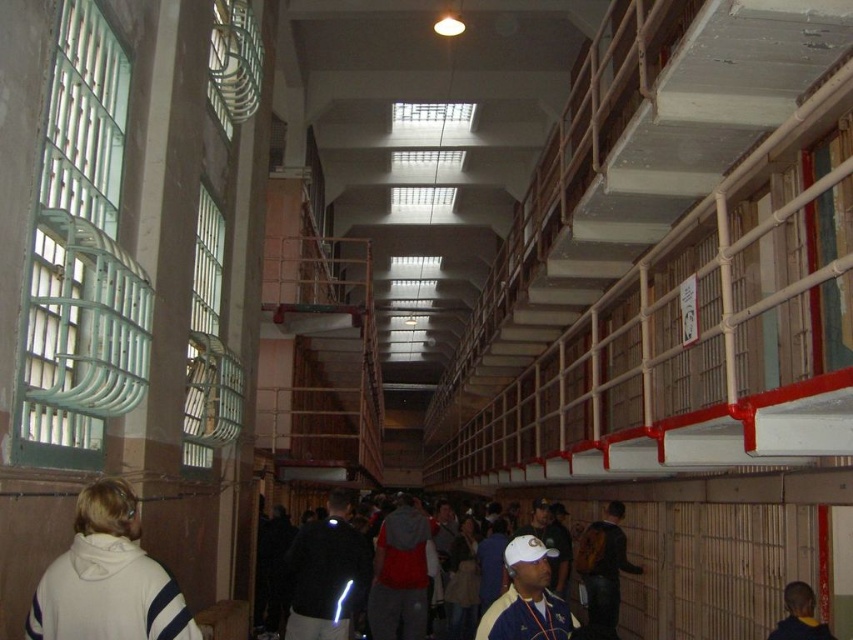
Measure the distance between point (x=138, y=552) and camera.

Point (x=138, y=552) is 3.22 meters from camera.

Between point (123, 573) and point (585, 625), which one is positioned in front?

Point (123, 573)

Image resolution: width=853 pixels, height=640 pixels. In order to click on white fleece jacket at lower left in this screenshot , I will do `click(108, 579)`.

Image resolution: width=853 pixels, height=640 pixels. I want to click on white fleece jacket at lower left, so click(x=108, y=579).

Between point (392, 541) and point (781, 620), which one is positioned in front?

Point (781, 620) is more forward.

Is red fabric jacket at center shorter than dark blue hoodie at lower right?

Incorrect, red fabric jacket at center's height does not fall short of dark blue hoodie at lower right's.

The image size is (853, 640). What are the coordinates of `red fabric jacket at center` in the screenshot? It's located at (399, 573).

Between white matte baseball cap at lower center and matte brown backpack at lower center, which one has less height?

Standing shorter between the two is white matte baseball cap at lower center.

This screenshot has width=853, height=640. Identify the location of white matte baseball cap at lower center. (527, 596).

Find the location of `white matte baseball cap at lower center`. white matte baseball cap at lower center is located at coordinates click(527, 596).